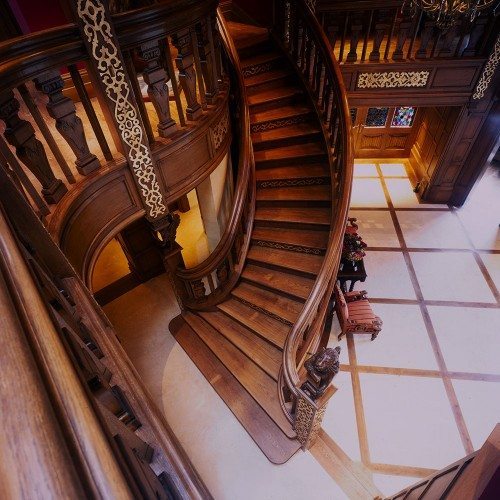
Where is `floor`? The width and height of the screenshot is (500, 500). floor is located at coordinates (419, 355), (100, 274), (163, 369).